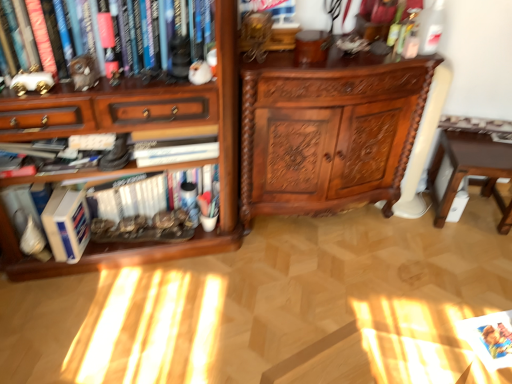
The height and width of the screenshot is (384, 512). I want to click on free space between polished wood cabinet at center and wooden bookcase at left, so click(310, 243).